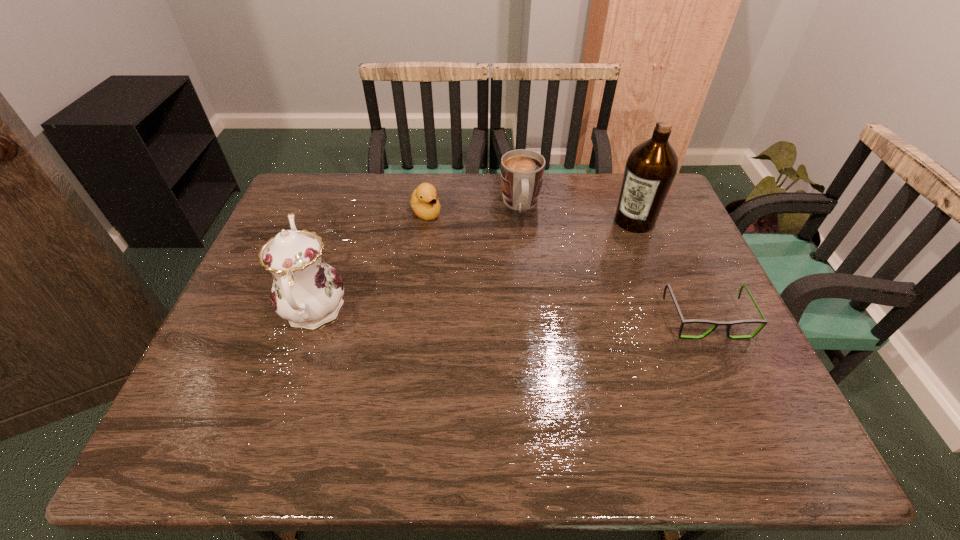
Identify the location of olive oil that is at the far edge. The width and height of the screenshot is (960, 540). (651, 167).

You are a GUI agent. You are given a task and a screenshot of the screen. Output one action in this format:
    pyautogui.click(x=<x>, y=<y>)
    Task: Click on the mug at the far edge
    
    Given the screenshot: What is the action you would take?
    (x=522, y=171)

The image size is (960, 540). Find the location of `object that is positioned at the left edge`. object that is positioned at the left edge is located at coordinates (306, 291).

At what (x,y) coordinates should I click in order to perform the action: click on spectacles that is positioned at the right edge. Please return your answer as a coordinate pair (x, y). This screenshot has width=960, height=540. Looking at the image, I should click on (728, 324).

You are a GUI agent. You are given a task and a screenshot of the screen. Output one action in this format:
    pyautogui.click(x=<x>, y=<y>)
    Task: Click on the olive oil located in the right edge section of the desktop
    
    Given the screenshot: What is the action you would take?
    pyautogui.click(x=651, y=167)

You are a GUI agent. You are given a task and a screenshot of the screen. Output one action in this format:
    pyautogui.click(x=<x>, y=<y>)
    Task: Click on the object located at the far right corner
    The height and width of the screenshot is (540, 960).
    Given the screenshot: What is the action you would take?
    pyautogui.click(x=651, y=167)

What are the coordinates of `free spot at the far edge of the desktop` in the screenshot? It's located at (564, 213).

This screenshot has height=540, width=960. In the image, there is a desktop. Find the location of `vacant space at the near edge`. vacant space at the near edge is located at coordinates tap(591, 376).

The image size is (960, 540). Identify the location of blank space at the left edge. (328, 223).

Where is `free space at the right edge`? free space at the right edge is located at coordinates (674, 334).